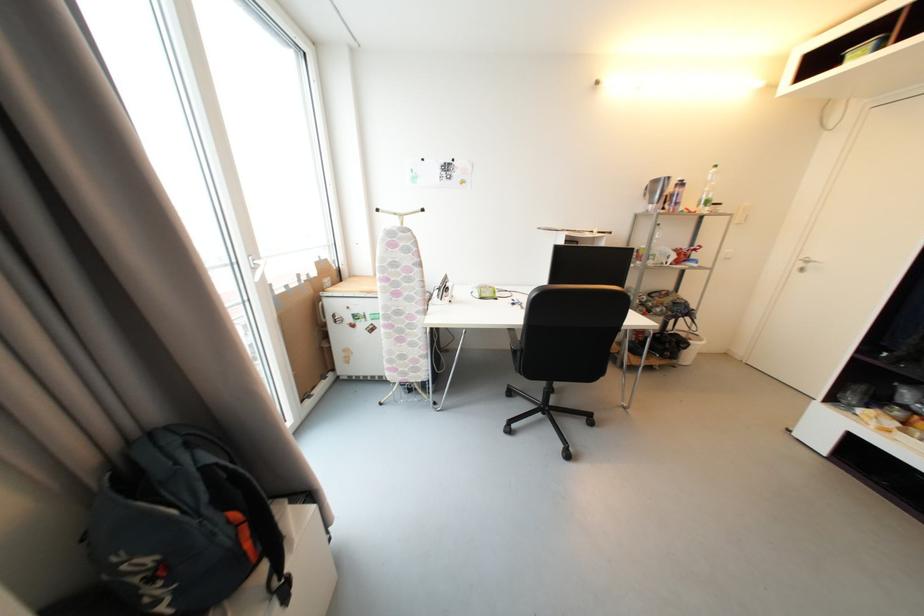
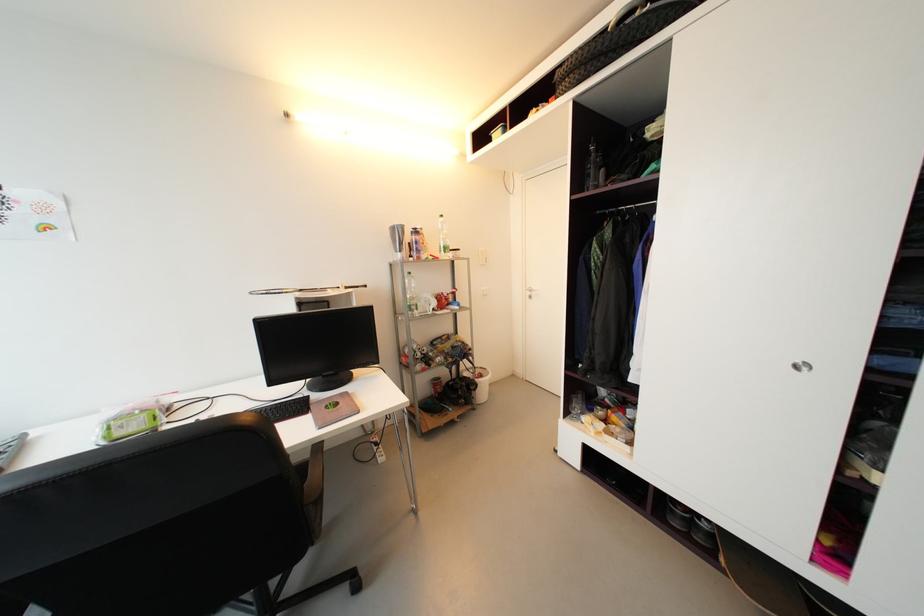
The point at (806,267) is marked in the first image. Where is the corresponding point in the second image?

(533, 294)